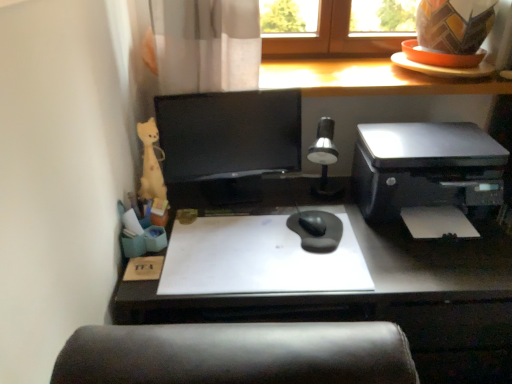
This screenshot has height=384, width=512. Identify the location of blank space situated above black glossy monitor at center (from a real-world perspective). (210, 90).